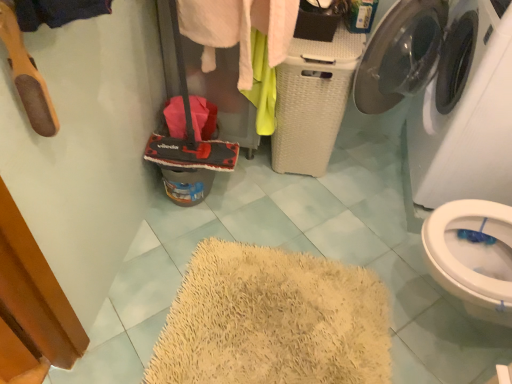
Question: Is soft pink towel at center at the right side of red fabric mop at center-left?

Choices:
 (A) yes
 (B) no

Answer: (A)

Question: Would you say soft pink towel at center is outside red fabric mop at center-left?

Choices:
 (A) yes
 (B) no

Answer: (A)

Question: Is soft pink towel at center facing towards red fabric mop at center-left?

Choices:
 (A) no
 (B) yes

Answer: (B)

Question: Can you confirm if soft pink towel at center is smaller than red fabric mop at center-left?

Choices:
 (A) yes
 (B) no

Answer: (B)

Question: Is the position of soft pink towel at center more distant than that of red fabric mop at center-left?

Choices:
 (A) no
 (B) yes

Answer: (B)

Question: From a real-world perspective, relative to soft pink towel at center, is red fabric mop at center-left vertically above or below?

Choices:
 (A) above
 (B) below

Answer: (A)

Question: Do you think red fabric mop at center-left is within soft pink towel at center, or outside of it?

Choices:
 (A) inside
 (B) outside

Answer: (B)

Question: From the image's perspective, relative to soft pink towel at center, is red fabric mop at center-left above or below?

Choices:
 (A) above
 (B) below

Answer: (B)

Question: Does point (187, 102) appear closer or farther from the camera than point (284, 16)?

Choices:
 (A) closer
 (B) farther

Answer: (B)

Question: Is point (489, 147) positioned closer to the camera than point (186, 124)?

Choices:
 (A) farther
 (B) closer

Answer: (B)

Question: From a real-world perspective, is white glossy washing machine at upper right positioned above or below red fabric mop at center-left?

Choices:
 (A) below
 (B) above

Answer: (A)

Question: From the image's perspective, relative to red fabric mop at center-left, is white glossy washing machine at upper right above or below?

Choices:
 (A) below
 (B) above

Answer: (A)

Question: From their relative heights in the image, would you say white glossy washing machine at upper right is taller or shorter than red fabric mop at center-left?

Choices:
 (A) short
 (B) tall

Answer: (B)

Question: Is soft pink towel at center situated inside red fabric mop at center-left or outside?

Choices:
 (A) outside
 (B) inside

Answer: (A)

Question: In terms of size, does soft pink towel at center appear bigger or smaller than red fabric mop at center-left?

Choices:
 (A) big
 (B) small

Answer: (A)